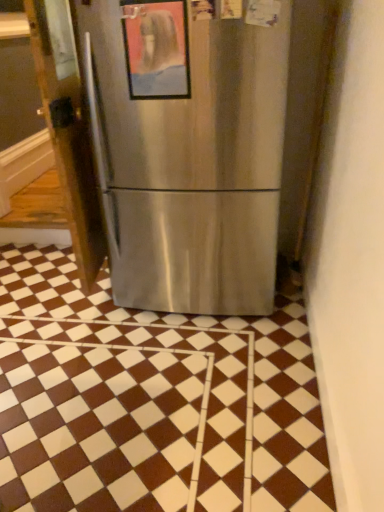
This screenshot has height=512, width=384. What are the coordinates of `brown/white checkered tile at center` in the screenshot? It's located at (151, 402).

Measure the distance between point (62, 3) and camera.

Point (62, 3) and camera are 6.66 feet apart.

Locate an element on the screen. The width and height of the screenshot is (384, 512). brown/white checkered tile at center is located at coordinates (151, 402).

Considering the sizes of objects satin silver refrigerator at left and metallic framed picture at center in the image provided, who is taller, satin silver refrigerator at left or metallic framed picture at center?

With more height is satin silver refrigerator at left.

Is there a large distance between satin silver refrigerator at left and metallic framed picture at center?

No, there isn't a large distance between satin silver refrigerator at left and metallic framed picture at center.

Considering the sizes of satin silver refrigerator at left and metallic framed picture at center in the image, is satin silver refrigerator at left bigger or smaller than metallic framed picture at center?

Considering their sizes, satin silver refrigerator at left takes up more space than metallic framed picture at center.

Is satin silver refrigerator at left looking in the opposite direction of metallic framed picture at center?

satin silver refrigerator at left does not have its back to metallic framed picture at center.

Does brown/white checkered tile at center have a smaller size compared to metallic framed picture at center?

No.

From the picture: Is brown/white checkered tile at center facing away from metallic framed picture at center?

That's not correct — brown/white checkered tile at center is not looking away from metallic framed picture at center.

From the picture: What's the angular difference between brown/white checkered tile at center and metallic framed picture at center's facing directions?

The angle between the facing direction of brown/white checkered tile at center and the facing direction of metallic framed picture at center is 176 degrees.

Considering the relative sizes of satin silver refrigerator at left and brown/white checkered tile at center in the image provided, is satin silver refrigerator at left smaller than brown/white checkered tile at center?

Yes.

From the image's perspective, is satin silver refrigerator at left on brown/white checkered tile at center?

Yes, from the image's perspective, satin silver refrigerator at left is above brown/white checkered tile at center.

You are a GUI agent. You are given a task and a screenshot of the screen. Output one action in this format:
    pyautogui.click(x=<x>, y=<y>)
    Task: Click on the door lying above the brown/white checkered tile at center (from the image's perspective)
    The image size is (384, 512).
    Given the screenshot: What is the action you would take?
    pyautogui.click(x=68, y=128)

Does satin silver refrigerator at left have a greater height compared to brown/white checkered tile at center?

Yes, satin silver refrigerator at left is taller than brown/white checkered tile at center.

Consider the image. Is brown/white checkered tile at center turned away from satin silver refrigerator at left?

No.

From a real-world perspective, who is located lower, brown/white checkered tile at center or satin silver refrigerator at left?

In real-world perspective, brown/white checkered tile at center is lower.

Are brown/white checkered tile at center and satin silver refrigerator at left beside each other?

No, brown/white checkered tile at center is not with satin silver refrigerator at left.

Identify the location of door behind the brown/white checkered tile at center. This screenshot has width=384, height=512. (68, 128).

Is metallic framed picture at center touching brown/white checkered tile at center?

No, metallic framed picture at center is not with brown/white checkered tile at center.

From a real-world perspective, is metallic framed picture at center above or below brown/white checkered tile at center?

metallic framed picture at center is situated higher than brown/white checkered tile at center in the real world.

From the picture: Is metallic framed picture at center thinner than brown/white checkered tile at center?

Yes.

Who is shorter, metallic framed picture at center or satin silver refrigerator at left?

With less height is metallic framed picture at center.

Which point is more forward, (131, 13) or (88, 137)?

The point (131, 13) is in front.

Looking at the image, does metallic framed picture at center seem bigger or smaller compared to satin silver refrigerator at left?

Considering their sizes, metallic framed picture at center takes up less space than satin silver refrigerator at left.

I want to click on door lying behind the metallic framed picture at center, so click(68, 128).

The image size is (384, 512). In order to click on picture frame located above the brown/white checkered tile at center (from a real-world perspective) in this screenshot , I will do `click(156, 48)`.

When comparing their distances from satin silver refrigerator at left, does brown/white checkered tile at center or metallic framed picture at center seem closer?

metallic framed picture at center is positioned closer to the anchor satin silver refrigerator at left.

Looking at the image, which one is located further to satin silver refrigerator at left, metallic framed picture at center or brown/white checkered tile at center?

brown/white checkered tile at center lies further to satin silver refrigerator at left than the other object.

Which object lies further to the anchor point metallic framed picture at center, brown/white checkered tile at center or satin silver refrigerator at left?

brown/white checkered tile at center is positioned further to the anchor metallic framed picture at center.

When comparing their distances from metallic framed picture at center, does satin silver refrigerator at left or brown/white checkered tile at center seem further?

The object further to metallic framed picture at center is brown/white checkered tile at center.

Estimate the real-world distances between objects in this image. Which object is further from brown/white checkered tile at center, metallic framed picture at center or satin silver refrigerator at left?

Among the two, metallic framed picture at center is located further to brown/white checkered tile at center.

From the image, which object appears to be farther from brown/white checkered tile at center, satin silver refrigerator at left or metallic framed picture at center?

metallic framed picture at center is further to brown/white checkered tile at center.

Identify the location of picture frame between satin silver refrigerator at left and brown/white checkered tile at center in the up-down direction. (156, 48).